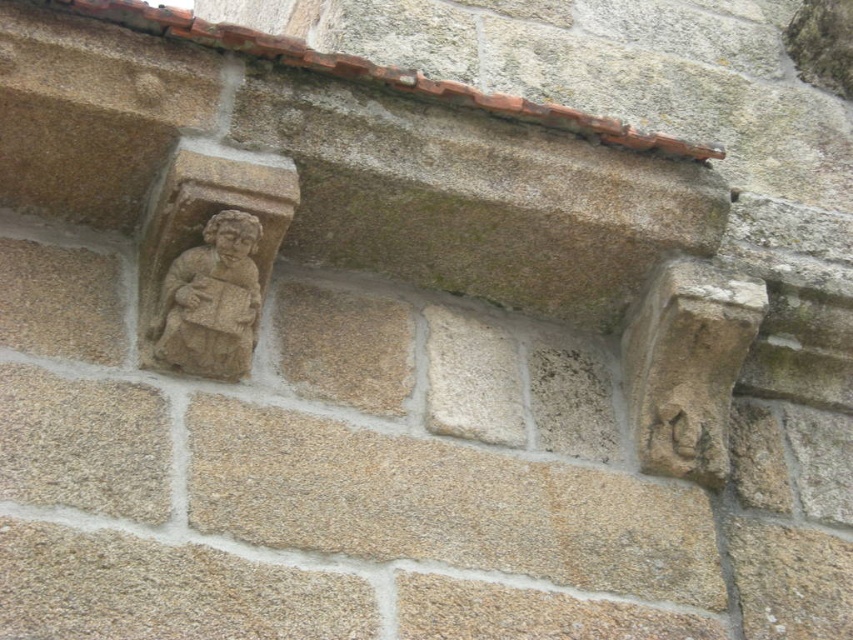
Which is above, beige stone figure at upper left or carved stone face at upper left?

carved stone face at upper left is above.

Locate an element on the screen. The image size is (853, 640). beige stone figure at upper left is located at coordinates (210, 301).